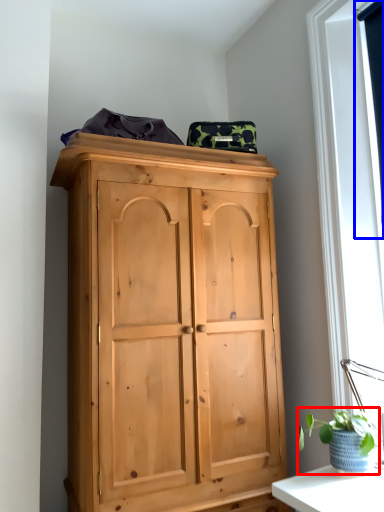
Question: Which object is further to the camera taking this photo, houseplant (highlighted by a red box) or window screen (highlighted by a blue box)?

Choices:
 (A) houseplant
 (B) window screen

Answer: (B)